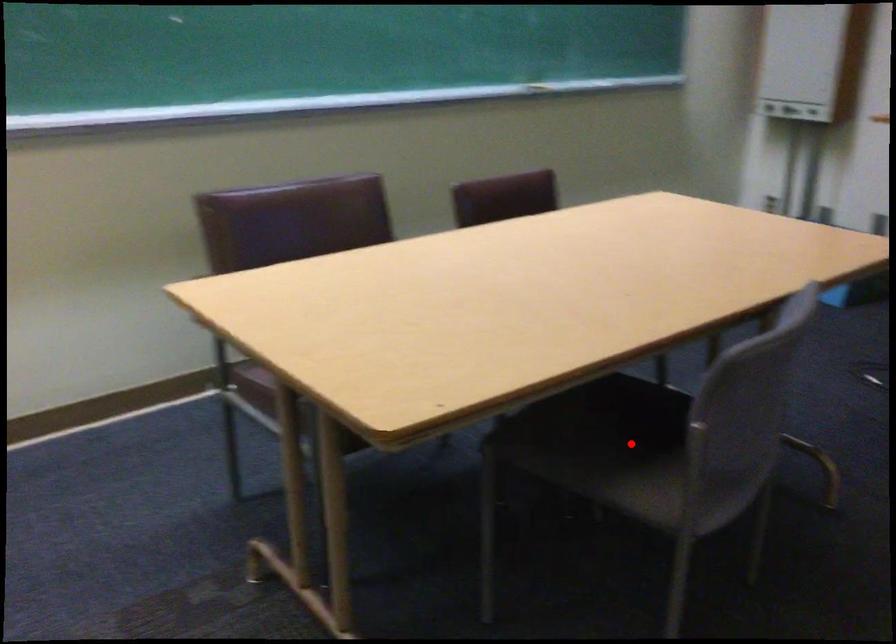
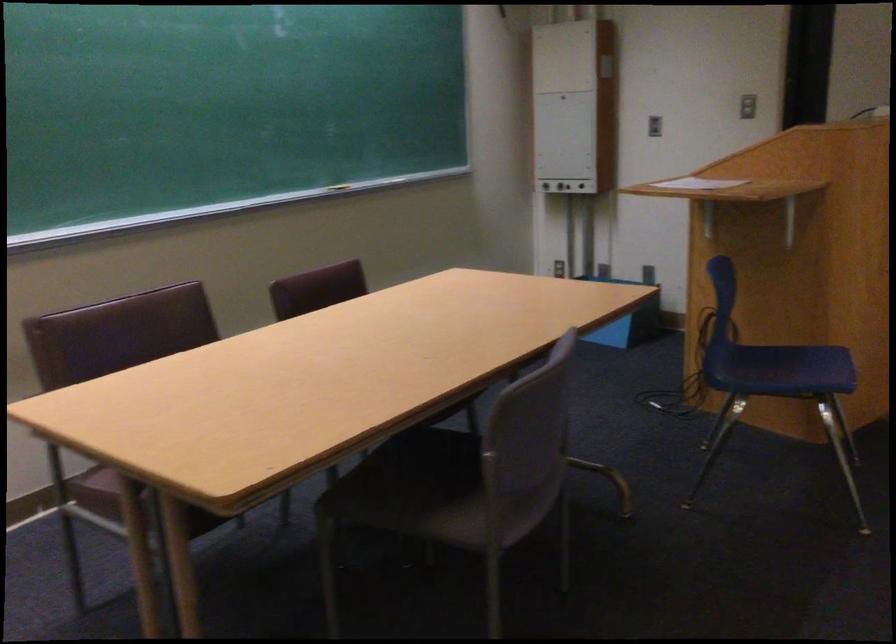
Question: A red point is marked in image1. In image2, is the corresponding 3D point closer to the camera or farther? Reply with the corresponding letter.

Choices:
 (A) The corresponding 3D point is closer.
 (B) The corresponding 3D point is farther.

Answer: (B)